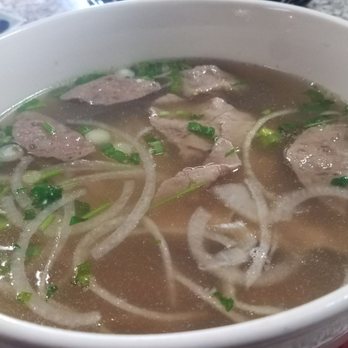
This screenshot has width=348, height=348. In order to click on white glass bowl in this screenshot , I will do `click(95, 55)`.